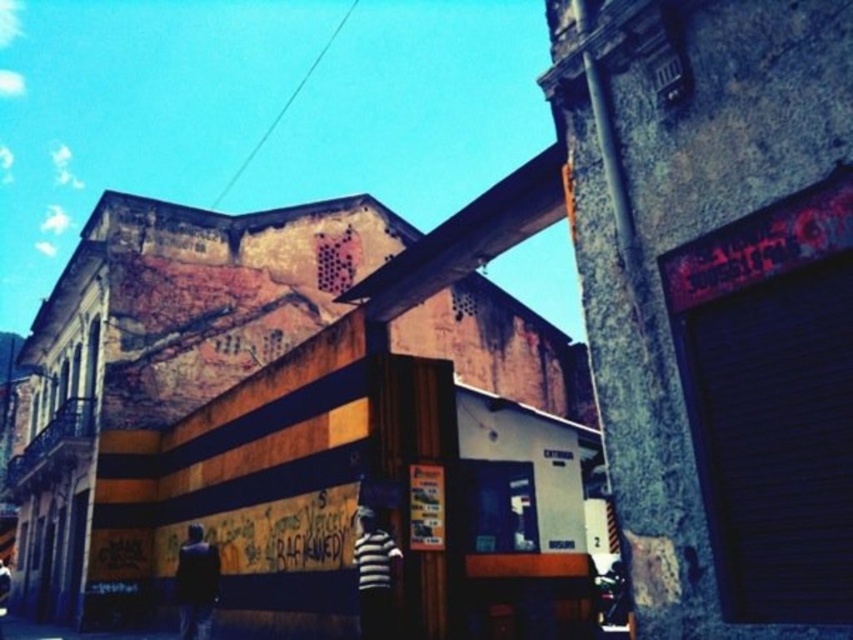
Question: Which of the following is the farthest from the observer?

Choices:
 (A) dark fabric jacket at lower left
 (B) striped shirt at center

Answer: (A)

Question: Where is striped shirt at center located in relation to dark fabric jacket at lower left in the image?

Choices:
 (A) left
 (B) right

Answer: (B)

Question: Is striped shirt at center to the left of dark fabric jacket at lower left from the viewer's perspective?

Choices:
 (A) no
 (B) yes

Answer: (A)

Question: Among these objects, which one is nearest to the camera?

Choices:
 (A) dark fabric jacket at lower left
 (B) striped shirt at center

Answer: (B)

Question: Is striped shirt at center thinner than dark fabric jacket at lower left?

Choices:
 (A) yes
 (B) no

Answer: (A)